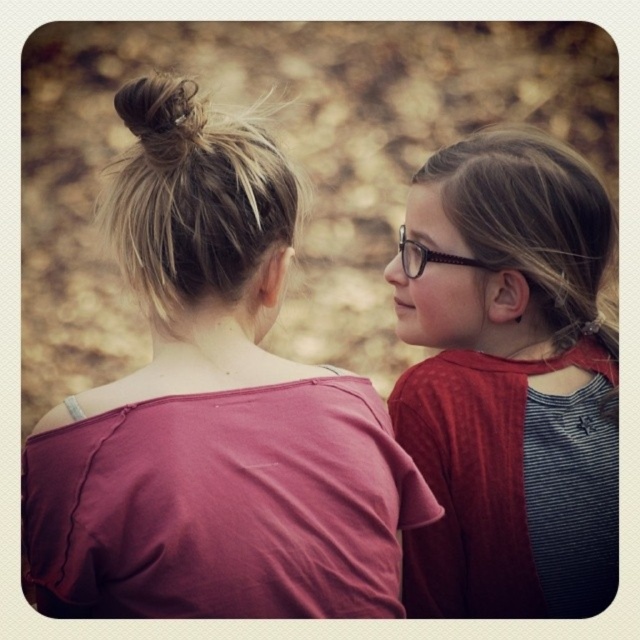
Who is positioned more to the right, blonde hair at upper right or brown hair bun at upper left?

Positioned to the right is blonde hair at upper right.

Is point (515, 186) closer to camera compared to point (168, 84)?

That is False.

Find the location of a particular element. The height and width of the screenshot is (640, 640). blonde hair at upper right is located at coordinates (532, 221).

Between matte brown hair at upper right and blondehair at upper left, which one appears on the left side from the viewer's perspective?

From the viewer's perspective, blondehair at upper left appears more on the left side.

Which is in front, point (445, 221) or point (211, 172)?

Point (211, 172) is more forward.

This screenshot has width=640, height=640. Identify the location of matte brown hair at upper right. (508, 381).

Who is taller, matte pink shirt at upper left or brown hair bun at upper left?

matte pink shirt at upper left is taller.

Between point (154, 508) and point (170, 104), which one is positioned in front?

Point (154, 508) is in front.

Locate an element on the screen. Image resolution: width=640 pixels, height=640 pixels. matte pink shirt at upper left is located at coordinates (216, 428).